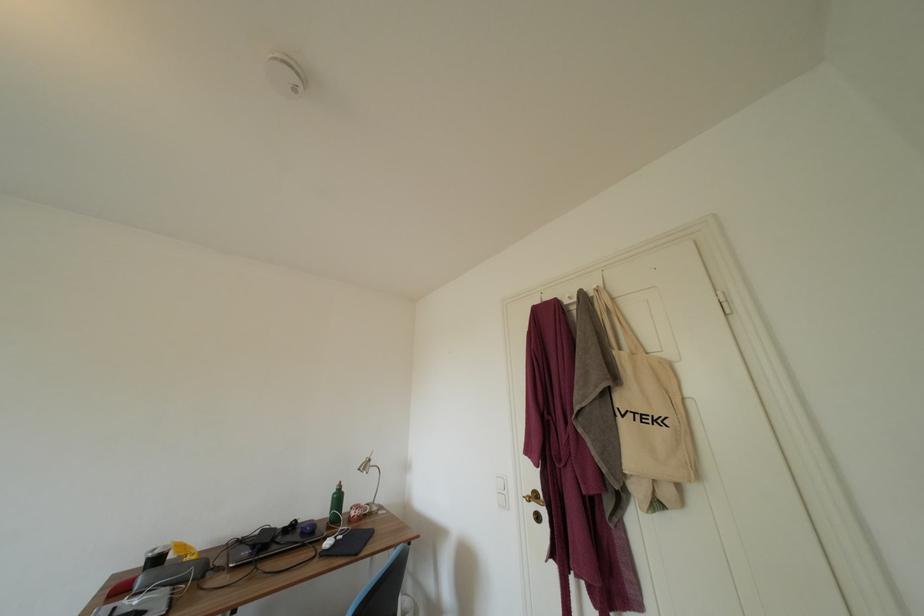
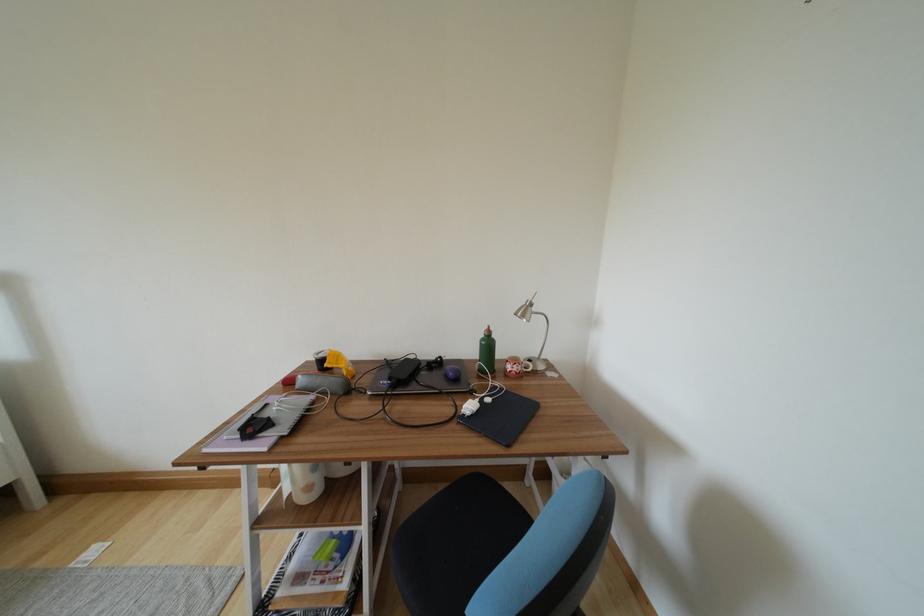
Find the pixel in the second image that matches point (370, 472) in the first image.

(528, 320)